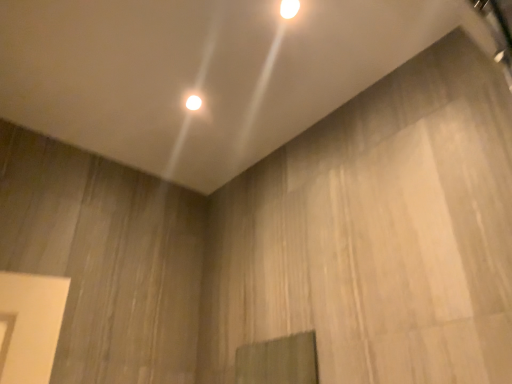
In order to click on white glossy light fixture at upper center, which is counted as the 1th lamp, starting from the front in this screenshot , I will do `click(289, 8)`.

This screenshot has width=512, height=384. What do you see at coordinates (289, 8) in the screenshot?
I see `white glossy light fixture at upper center, the 2th lamp positioned from the left` at bounding box center [289, 8].

Image resolution: width=512 pixels, height=384 pixels. What do you see at coordinates (193, 102) in the screenshot?
I see `white glossy light fixture at upper center, acting as the 2th lamp starting from the right` at bounding box center [193, 102].

How much space does white glossy light fixture at upper center, the first lamp in the back-to-front sequence, occupy vertically?

white glossy light fixture at upper center, the first lamp in the back-to-front sequence, is 0.39 inches tall.

This screenshot has width=512, height=384. In order to click on white glossy light fixture at upper center, which appears as the second lamp when viewed from the front in this screenshot , I will do `click(193, 102)`.

The height and width of the screenshot is (384, 512). Identify the location of white glossy light fixture at upper center, positioned as the first lamp in top-to-bottom order. (289, 8).

Is white glossy light fixture at upper center, the first lamp when ordered from right to left, to the right of white glossy light fixture at upper center, which appears as the second lamp when viewed from the front, from the viewer's perspective?

Indeed, white glossy light fixture at upper center, the first lamp when ordered from right to left, is positioned on the right side of white glossy light fixture at upper center, which appears as the second lamp when viewed from the front.

In the image, is white glossy light fixture at upper center, positioned as the first lamp in top-to-bottom order, positioned in front of or behind white glossy light fixture at upper center, which appears as the second lamp when viewed from the front?

white glossy light fixture at upper center, positioned as the first lamp in top-to-bottom order, is positioned closer to the viewer than white glossy light fixture at upper center, which appears as the second lamp when viewed from the front.

Considering the positions of point (289, 16) and point (189, 109), is point (289, 16) closer or farther from the camera than point (189, 109)?

Point (289, 16) is closer to the camera than point (189, 109).

In the scene shown: From the image's perspective, is white glossy light fixture at upper center, the first lamp when ordered from right to left, under white glossy light fixture at upper center, the first lamp in the back-to-front sequence?

No.

From a real-world perspective, which object stands above the other?

white glossy light fixture at upper center, acting as the 2th lamp starting from the right.

Considering the sizes of objects white glossy light fixture at upper center, the 2th lamp positioned from the back, and white glossy light fixture at upper center, acting as the 2th lamp starting from the right, in the image provided, who is wider, white glossy light fixture at upper center, the 2th lamp positioned from the back, or white glossy light fixture at upper center, acting as the 2th lamp starting from the right,?

Wider between the two is white glossy light fixture at upper center, acting as the 2th lamp starting from the right.

Can you confirm if white glossy light fixture at upper center, the 2th lamp positioned from the left, is shorter than white glossy light fixture at upper center, which is the 2th lamp in top-to-bottom order?

No.

Does white glossy light fixture at upper center, the 2th lamp positioned from the back, have a larger size compared to white glossy light fixture at upper center, acting as the 2th lamp starting from the right?

Correct, white glossy light fixture at upper center, the 2th lamp positioned from the back, is larger in size than white glossy light fixture at upper center, acting as the 2th lamp starting from the right.

Is white glossy light fixture at upper center, which appears as the second lamp when ordered from the bottom, positioned beyond the bounds of white glossy light fixture at upper center, the first lamp in the back-to-front sequence?

Yes, white glossy light fixture at upper center, which appears as the second lamp when ordered from the bottom, is not within white glossy light fixture at upper center, the first lamp in the back-to-front sequence.

Are white glossy light fixture at upper center, positioned as the first lamp in top-to-bottom order, and white glossy light fixture at upper center, which is the 2th lamp in top-to-bottom order, far apart?

No, there isn't a large distance between white glossy light fixture at upper center, positioned as the first lamp in top-to-bottom order, and white glossy light fixture at upper center, which is the 2th lamp in top-to-bottom order.

Is white glossy light fixture at upper center, the 2th lamp positioned from the back, facing towards white glossy light fixture at upper center, the first lamp in the back-to-front sequence?

No.

Can you tell me how much white glossy light fixture at upper center, the first lamp when ordered from right to left, and white glossy light fixture at upper center, acting as the 2th lamp starting from the right, differ in facing direction?

9.91e-05 degrees.

What are the coordinates of `lamp located above the white glossy light fixture at upper center, which appears as the second lamp when viewed from the front (from the image's perspective)` in the screenshot? It's located at (289, 8).

Is white glossy light fixture at upper center, positioned as the first lamp in bottom-to-top order, to the left or to the right of white glossy light fixture at upper center, the 2th lamp positioned from the left, in the image?

In the image, white glossy light fixture at upper center, positioned as the first lamp in bottom-to-top order, appears on the left side of white glossy light fixture at upper center, the 2th lamp positioned from the left.

Which is in front, white glossy light fixture at upper center, acting as the 2th lamp starting from the right, or white glossy light fixture at upper center, which is counted as the 1th lamp, starting from the front?

white glossy light fixture at upper center, which is counted as the 1th lamp, starting from the front.

Between point (198, 100) and point (284, 16), which one is positioned in front?

The point (284, 16) is closer to the camera.

From the image's perspective, which one is positioned higher, white glossy light fixture at upper center, which is the 2th lamp in top-to-bottom order, or white glossy light fixture at upper center, which appears as the second lamp when ordered from the bottom?

From the image's view, white glossy light fixture at upper center, which appears as the second lamp when ordered from the bottom, is above.

Looking at this image, from a real-world perspective, is white glossy light fixture at upper center, which appears as the second lamp when viewed from the front, over white glossy light fixture at upper center, the 2th lamp positioned from the back?

Yes, from a real-world perspective, white glossy light fixture at upper center, which appears as the second lamp when viewed from the front, is over white glossy light fixture at upper center, the 2th lamp positioned from the back

Looking at their sizes, would you say white glossy light fixture at upper center, which appears as the second lamp when viewed from the front, is wider or thinner than white glossy light fixture at upper center, which appears as the second lamp when ordered from the bottom?

white glossy light fixture at upper center, which appears as the second lamp when viewed from the front, is wider than white glossy light fixture at upper center, which appears as the second lamp when ordered from the bottom.

Which of these two, white glossy light fixture at upper center, acting as the 2th lamp starting from the right, or white glossy light fixture at upper center, positioned as the first lamp in top-to-bottom order, stands taller?

white glossy light fixture at upper center, positioned as the first lamp in top-to-bottom order, is taller.

Is white glossy light fixture at upper center, which is the 2th lamp in top-to-bottom order, bigger or smaller than white glossy light fixture at upper center, the first lamp when ordered from right to left?

white glossy light fixture at upper center, which is the 2th lamp in top-to-bottom order, is smaller than white glossy light fixture at upper center, the first lamp when ordered from right to left.

Is white glossy light fixture at upper center, the first lamp in the back-to-front sequence, spatially inside white glossy light fixture at upper center, which is counted as the 1th lamp, starting from the front, or outside of it?

white glossy light fixture at upper center, the first lamp in the back-to-front sequence, is spatially situated outside white glossy light fixture at upper center, which is counted as the 1th lamp, starting from the front.

Is white glossy light fixture at upper center, positioned as the first lamp in bottom-to-top order, with white glossy light fixture at upper center, which appears as the second lamp when ordered from the bottom?

No, white glossy light fixture at upper center, positioned as the first lamp in bottom-to-top order, is not in contact with white glossy light fixture at upper center, which appears as the second lamp when ordered from the bottom.

Is white glossy light fixture at upper center, acting as the 2th lamp starting from the right, facing towards white glossy light fixture at upper center, the first lamp when ordered from right to left?

Yes.

How many degrees apart are the facing directions of white glossy light fixture at upper center, acting as the 2th lamp starting from the right, and white glossy light fixture at upper center, which appears as the second lamp when ordered from the bottom?

They differ by 9.91e-05 degrees in their facing directions.

Based on the photo, measure the distance between white glossy light fixture at upper center, which appears as the second lamp when viewed from the front, and white glossy light fixture at upper center, positioned as the first lamp in top-to-bottom order.

The distance of white glossy light fixture at upper center, which appears as the second lamp when viewed from the front, from white glossy light fixture at upper center, positioned as the first lamp in top-to-bottom order, is 49.15 centimeters.

Image resolution: width=512 pixels, height=384 pixels. In order to click on lamp on the left of white glossy light fixture at upper center, the first lamp when ordered from right to left in this screenshot , I will do `click(193, 102)`.

This screenshot has width=512, height=384. I want to click on lamp in front of the white glossy light fixture at upper center, the 1th lamp when ordered from left to right, so click(289, 8).

Where is `lamp below the white glossy light fixture at upper center, the first lamp in the back-to-front sequence (from a real-world perspective)`? This screenshot has width=512, height=384. lamp below the white glossy light fixture at upper center, the first lamp in the back-to-front sequence (from a real-world perspective) is located at coordinates (289, 8).